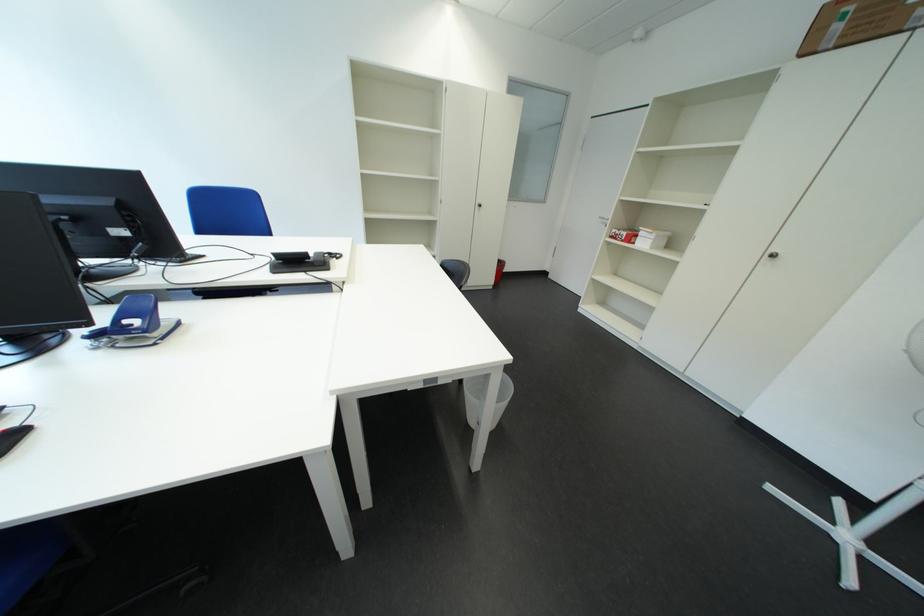
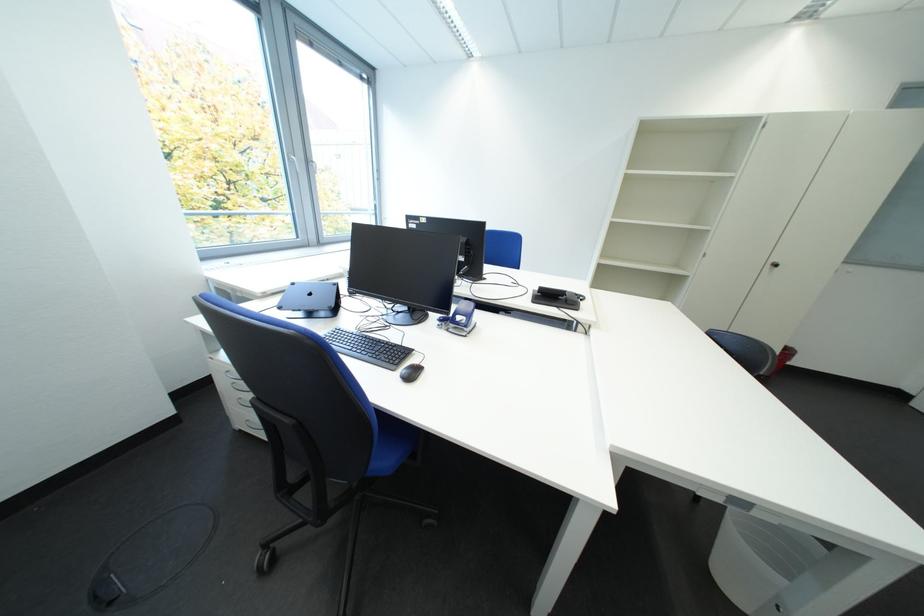
Question: The camera is either moving clockwise (left) or counter-clockwise (right) around the object. The first image is from the beginning of the video and the second image is from the end. Is the camera moving left or right when shooting the video?

Choices:
 (A) Left
 (B) Right

Answer: (B)